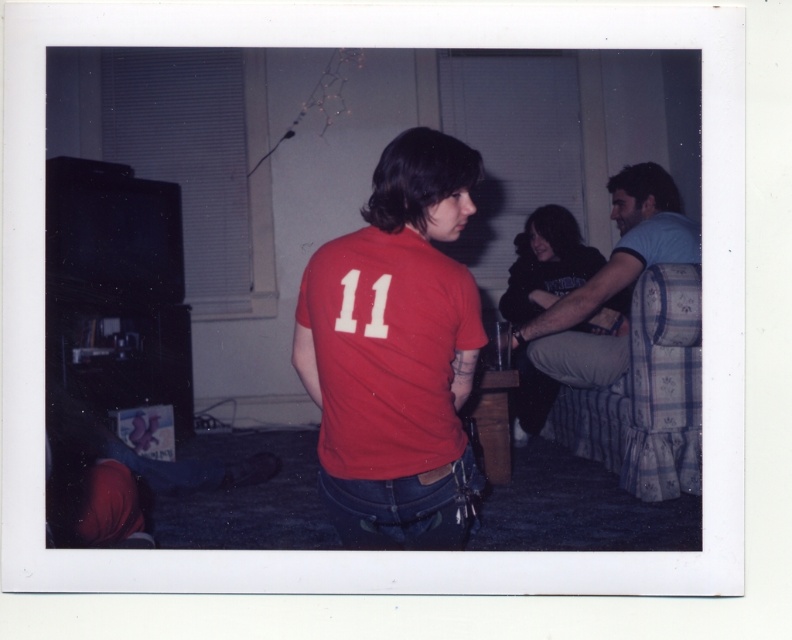
Question: Which point is closer to the camera taking this photo?

Choices:
 (A) (355, 272)
 (B) (554, 333)

Answer: (A)

Question: Among these objects, which one is farthest from the camera?

Choices:
 (A) light blue cotton shirt at right
 (B) matte red t-shirt at center

Answer: (A)

Question: Is matte red t-shirt at center smaller than light blue cotton shirt at right?

Choices:
 (A) yes
 (B) no

Answer: (A)

Question: Observing the image, what is the correct spatial positioning of matte red t-shirt at center in reference to light blue cotton shirt at right?

Choices:
 (A) right
 (B) left

Answer: (B)

Question: Which of the following is the closest to the observer?

Choices:
 (A) light blue cotton shirt at right
 (B) matte red t-shirt at center

Answer: (B)

Question: Is matte red t-shirt at center positioned before light blue cotton shirt at right?

Choices:
 (A) yes
 (B) no

Answer: (A)